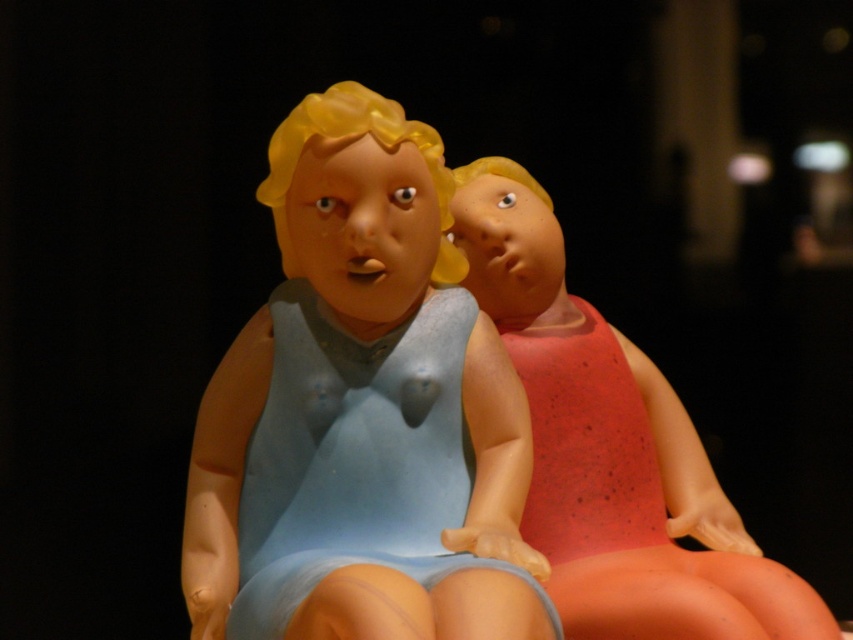
Question: Can you confirm if matte blue dress at center is smaller than matte red swimsuit at right?

Choices:
 (A) yes
 (B) no

Answer: (B)

Question: Which object appears farthest from the camera in this image?

Choices:
 (A) matte red swimsuit at right
 (B) matte blue dress at center

Answer: (A)

Question: Among these objects, which one is nearest to the camera?

Choices:
 (A) matte red swimsuit at right
 (B) matte blue dress at center

Answer: (B)

Question: Does matte blue dress at center appear over matte red swimsuit at right?

Choices:
 (A) no
 (B) yes

Answer: (B)

Question: Is matte blue dress at center bigger than matte red swimsuit at right?

Choices:
 (A) no
 (B) yes

Answer: (B)